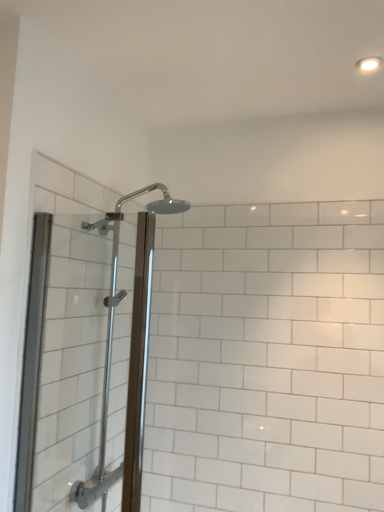
Question: From a real-world perspective, is polished chrome shower head at upper center physically below white glossy light fixture at upper right?

Choices:
 (A) yes
 (B) no

Answer: (A)

Question: Is polished chrome shower head at upper center aimed at white glossy light fixture at upper right?

Choices:
 (A) no
 (B) yes

Answer: (A)

Question: From a real-world perspective, is polished chrome shower head at upper center on top of white glossy light fixture at upper right?

Choices:
 (A) no
 (B) yes

Answer: (A)

Question: Is polished chrome shower head at upper center thinner than white glossy light fixture at upper right?

Choices:
 (A) no
 (B) yes

Answer: (A)

Question: From the image's perspective, is polished chrome shower head at upper center located above white glossy light fixture at upper right?

Choices:
 (A) yes
 (B) no

Answer: (B)

Question: Does polished chrome shower head at upper center have a smaller size compared to white glossy light fixture at upper right?

Choices:
 (A) yes
 (B) no

Answer: (B)

Question: Is white glossy light fixture at upper right taller than clear glass shower door at left?

Choices:
 (A) yes
 (B) no

Answer: (B)

Question: Can you confirm if white glossy light fixture at upper right is thinner than clear glass shower door at left?

Choices:
 (A) yes
 (B) no

Answer: (A)

Question: Would you consider white glossy light fixture at upper right to be distant from clear glass shower door at left?

Choices:
 (A) no
 (B) yes

Answer: (B)

Question: Is white glossy light fixture at upper right next to clear glass shower door at left and touching it?

Choices:
 (A) no
 (B) yes

Answer: (A)

Question: From the image's perspective, is white glossy light fixture at upper right under clear glass shower door at left?

Choices:
 (A) yes
 (B) no

Answer: (B)

Question: From a real-world perspective, does white glossy light fixture at upper right sit lower than clear glass shower door at left?

Choices:
 (A) no
 (B) yes

Answer: (A)

Question: Is polished chrome shower head at upper center turned away from clear glass shower door at left?

Choices:
 (A) yes
 (B) no

Answer: (B)